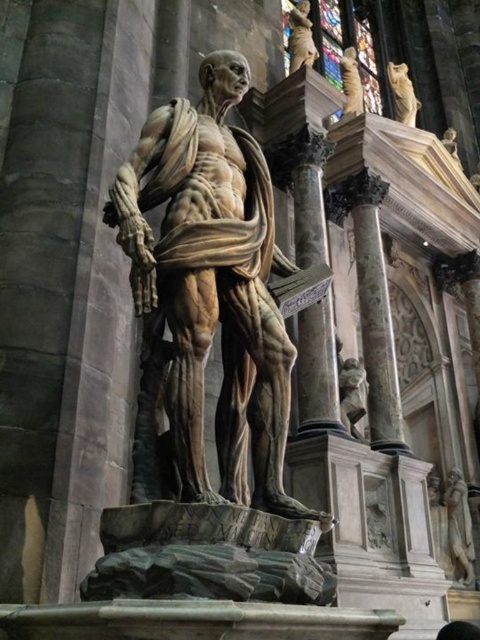
Question: Estimate the real-world distances between objects in this image. Which object is farther from the polished marble statue at center?

Choices:
 (A) stained glass at upper right
 (B) bronze statue at upper right

Answer: (A)

Question: Estimate the real-world distances between objects in this image. Which object is closer to the polished marble statue at center?

Choices:
 (A) polished bronze statue at right
 (B) golden stone cat at upper right
 (C) stained glass at upper right

Answer: (A)

Question: Which of the following is the closest to the observer?

Choices:
 (A) (468, 545)
 (B) (324, 44)

Answer: (A)

Question: Is the position of stained glass at upper right less distant than that of polished bronze statue at right?

Choices:
 (A) yes
 (B) no

Answer: (A)

Question: Does polished bronze statue at right appear over bronze statue at upper right?

Choices:
 (A) no
 (B) yes

Answer: (A)

Question: Is stained glass at upper right bigger than golden stone cat at upper right?

Choices:
 (A) no
 (B) yes

Answer: (B)